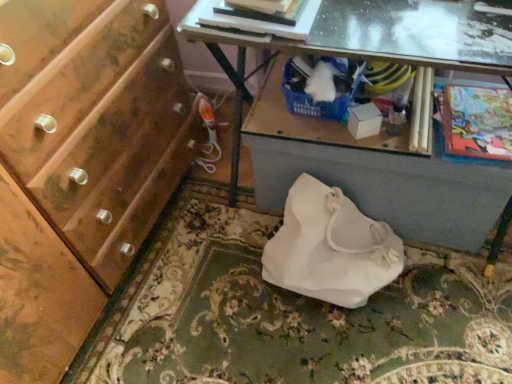
Image resolution: width=512 pixels, height=384 pixels. I want to click on vacant region below hardcover book at upper center (from a real-world perspective), so click(x=267, y=111).